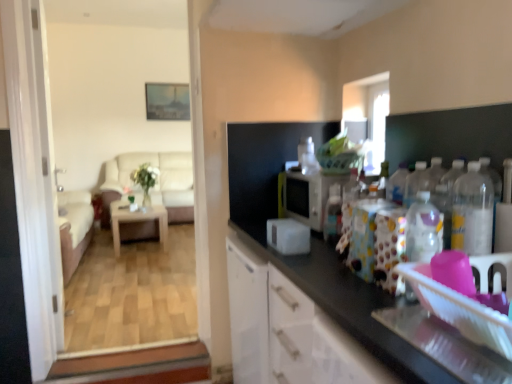
Question: Considering the relative sizes of clear plastic bottle at right, positioned as the 2th bottle in back-to-front order, and white matte microwave at center, placed as the 2th appliance when sorted from front to back, in the image provided, is clear plastic bottle at right, positioned as the 2th bottle in back-to-front order, thinner than white matte microwave at center, placed as the 2th appliance when sorted from front to back,?

Choices:
 (A) no
 (B) yes

Answer: (B)

Question: Does clear plastic bottle at right, the 2th bottle from the front, contain white matte microwave at center, placed as the 1th appliance when sorted from back to front?

Choices:
 (A) yes
 (B) no

Answer: (B)

Question: Is clear plastic bottle at right, positioned as the first bottle in right-to-left order, to the left of white matte microwave at center, placed as the 1th appliance when sorted from back to front, from the viewer's perspective?

Choices:
 (A) yes
 (B) no

Answer: (B)

Question: From the image's perspective, does clear plastic bottle at right, placed as the third bottle when sorted from left to right, appear lower than white matte microwave at center, placed as the 1th appliance when sorted from back to front?

Choices:
 (A) yes
 (B) no

Answer: (A)

Question: Does clear plastic bottle at right, the 2th bottle from the front, appear on the right side of white matte microwave at center, placed as the 2th appliance when sorted from front to back?

Choices:
 (A) yes
 (B) no

Answer: (A)

Question: Considering the relative positions of white plastic toaster at center, the second appliance viewed from the back, and clear plastic bottle at right, placed as the third bottle when sorted from left to right, in the image provided, is white plastic toaster at center, the second appliance viewed from the back, to the left or to the right of clear plastic bottle at right, placed as the third bottle when sorted from left to right,?

Choices:
 (A) right
 (B) left

Answer: (B)

Question: Considering their positions, is white plastic toaster at center, the second appliance viewed from the back, located in front of or behind clear plastic bottle at right, positioned as the first bottle in right-to-left order?

Choices:
 (A) front
 (B) behind

Answer: (B)

Question: From a real-world perspective, relative to clear plastic bottle at right, positioned as the first bottle in right-to-left order, is white plastic toaster at center, which is the first appliance in front-to-back order, vertically above or below?

Choices:
 (A) below
 (B) above

Answer: (A)

Question: Is point (300, 238) positioned closer to the camera than point (493, 172)?

Choices:
 (A) farther
 (B) closer

Answer: (A)

Question: In terms of height, does white matte microwave at center, placed as the 1th appliance when sorted from back to front, look taller or shorter compared to translucent plastic bottle at center, the 1th bottle positioned from the back?

Choices:
 (A) short
 (B) tall

Answer: (B)

Question: In the image, is white matte microwave at center, placed as the 1th appliance when sorted from back to front, positioned in front of or behind translucent plastic bottle at center, which is counted as the 3th bottle, starting from the right?

Choices:
 (A) behind
 (B) front

Answer: (A)

Question: From the image's perspective, is white matte microwave at center, placed as the 2th appliance when sorted from front to back, positioned above or below translucent plastic bottle at center, the 3th bottle when ordered from front to back?

Choices:
 (A) below
 (B) above

Answer: (B)

Question: From a real-world perspective, is white matte microwave at center, placed as the 1th appliance when sorted from back to front, positioned above or below translucent plastic bottle at center, which is counted as the 3th bottle, starting from the right?

Choices:
 (A) above
 (B) below

Answer: (A)

Question: Based on their positions, is white glossy screen door at left, marked as the 2th screen door in a left-to-right arrangement, located to the left or right of translucent plastic bottle at center, the 3th bottle when ordered from front to back?

Choices:
 (A) left
 (B) right

Answer: (A)

Question: From the image's perspective, is white glossy screen door at left, the 1th screen door when ordered from right to left, located above or below translucent plastic bottle at center, which is counted as the 3th bottle, starting from the right?

Choices:
 (A) below
 (B) above

Answer: (B)